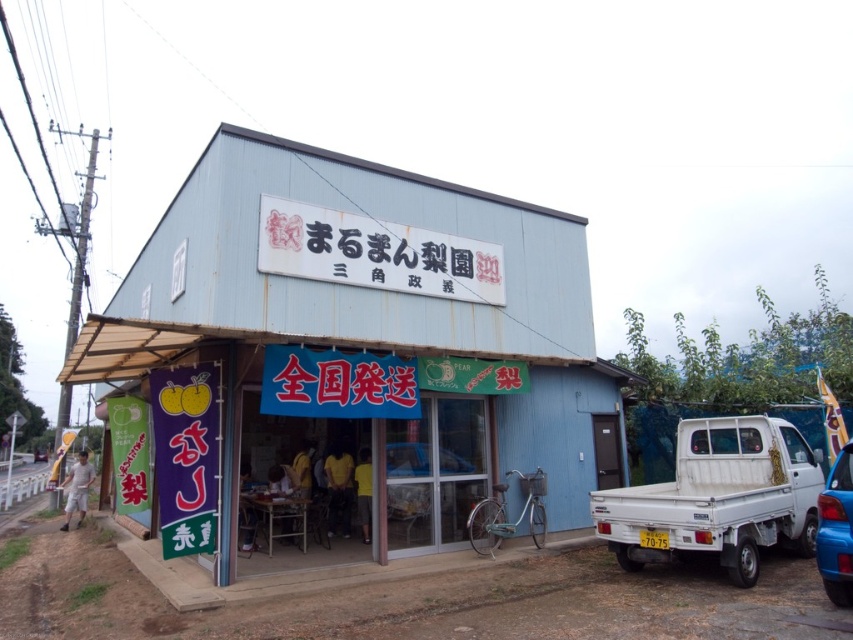
Question: Estimate the real-world distances between objects in this image. Which object is closer to the white matte signboard at center?

Choices:
 (A) blue glossy car at lower right
 (B) white matte truck at right
 (C) blue corrugated metal hut at center

Answer: (C)

Question: Does white matte signboard at center appear on the right side of blue glossy car at lower right?

Choices:
 (A) no
 (B) yes

Answer: (A)

Question: Is white matte truck at right positioned at the back of white matte signboard at center?

Choices:
 (A) no
 (B) yes

Answer: (A)

Question: Among these objects, which one is farthest from the camera?

Choices:
 (A) blue corrugated metal hut at center
 (B) blue glossy car at lower right
 (C) white matte truck at right

Answer: (C)

Question: Does blue corrugated metal hut at center lie behind white matte truck at right?

Choices:
 (A) no
 (B) yes

Answer: (A)

Question: Which object is positioned closest to the white matte truck at right?

Choices:
 (A) white matte signboard at center
 (B) blue glossy car at lower right

Answer: (B)